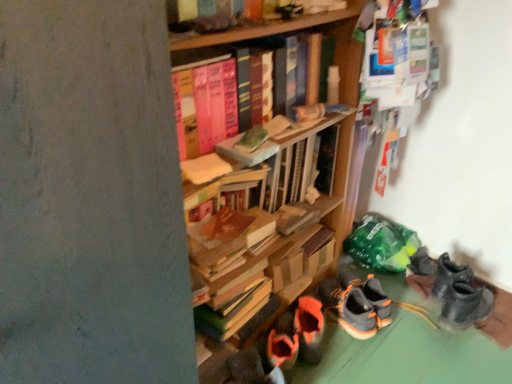
Question: Is gray suede sneakers at lower center far away from hardcover books at upper center?

Choices:
 (A) no
 (B) yes

Answer: (A)

Question: Is gray suede sneakers at lower center not inside hardcover books at upper center?

Choices:
 (A) no
 (B) yes

Answer: (B)

Question: Is gray suede sneakers at lower center next to hardcover books at upper center?

Choices:
 (A) yes
 (B) no

Answer: (B)

Question: Is gray suede sneakers at lower center to the left of hardcover books at upper center from the viewer's perspective?

Choices:
 (A) no
 (B) yes

Answer: (A)

Question: From a real-world perspective, is gray suede sneakers at lower center located higher than hardcover books at upper center?

Choices:
 (A) yes
 (B) no

Answer: (B)

Question: Considering the relative sizes of gray suede sneakers at lower center and hardcover books at upper center in the image provided, is gray suede sneakers at lower center taller than hardcover books at upper center?

Choices:
 (A) yes
 (B) no

Answer: (B)

Question: Does hardcover books at upper center have a smaller size compared to gray suede sneakers at lower center?

Choices:
 (A) yes
 (B) no

Answer: (B)

Question: From a real-world perspective, is hardcover books at upper center on top of gray suede sneakers at lower center?

Choices:
 (A) yes
 (B) no

Answer: (A)

Question: Does hardcover books at upper center have a lesser height compared to gray suede sneakers at lower center?

Choices:
 (A) no
 (B) yes

Answer: (A)

Question: Is hardcover books at upper center behind gray suede sneakers at lower center?

Choices:
 (A) yes
 (B) no

Answer: (B)

Question: Can you confirm if hardcover books at upper center is bigger than gray suede sneakers at lower center?

Choices:
 (A) yes
 (B) no

Answer: (A)

Question: From the image's perspective, is hardcover books at upper center under gray suede sneakers at lower center?

Choices:
 (A) yes
 (B) no

Answer: (B)

Question: Does point (186, 120) appear closer or farther from the camera than point (378, 317)?

Choices:
 (A) closer
 (B) farther

Answer: (A)